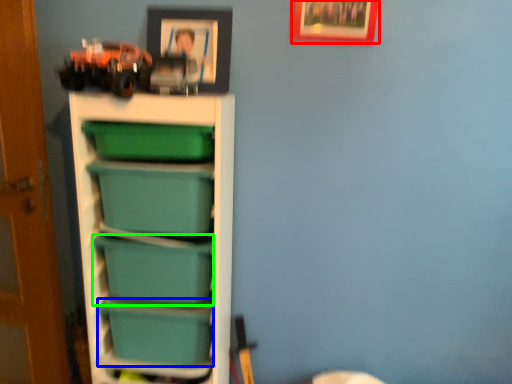
Question: Which is farther away from picture frame (highlighted by a red box)? box (highlighted by a blue box) or box (highlighted by a green box)?

Choices:
 (A) box
 (B) box

Answer: (A)